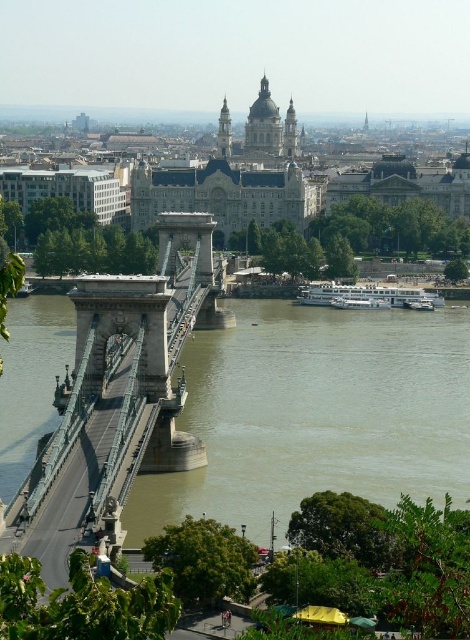
You are standing at the starting point of the suspension bridge. Looking towards the green stone bridge at center, what direction should you walk to reach it?

Since the green stone bridge at center is located at point [316,413], you should walk forward towards the center of the bridge to reach it.

You are standing at the suspension bridge and want to determine which of the two points, point [297,470] or point [203,444], is closer to you. Based on the scene description, which point is nearer?

Point [297,470] is closer to the viewer than point [203,444].